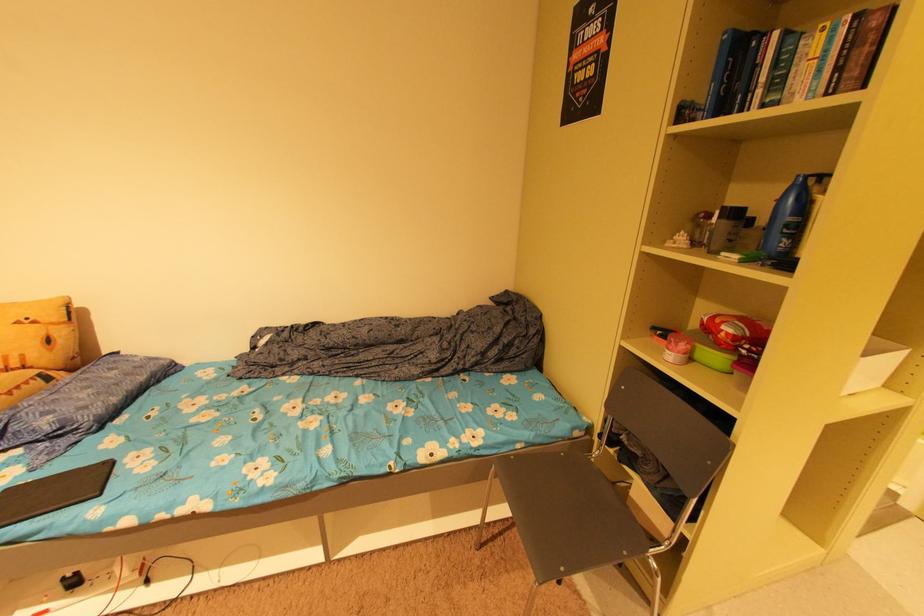
Locate an element on the screen. red and white bag is located at coordinates (734, 330).